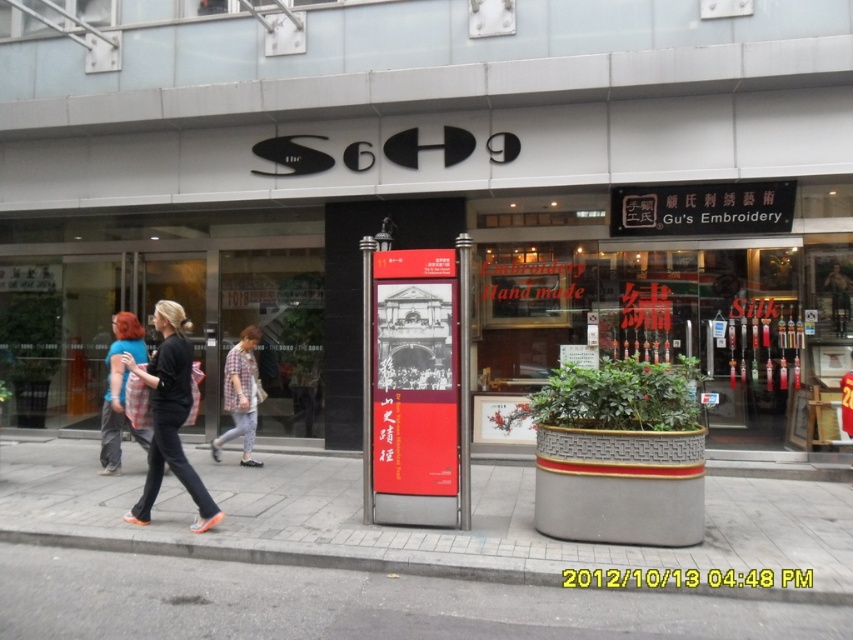
Question: Is plaid fabric shirt at left further to the viewer compared to plaid fabric shirt at center?

Choices:
 (A) no
 (B) yes

Answer: (A)

Question: Among these points, which one is nearest to the camera?

Choices:
 (A) (474, 636)
 (B) (230, 365)

Answer: (A)

Question: Can you confirm if gray concrete pavement at center is positioned above black matte pants at center?

Choices:
 (A) yes
 (B) no

Answer: (B)

Question: Which point is farther from the camera taking this photo?

Choices:
 (A) (134, 324)
 (B) (183, 380)
 (C) (257, 396)

Answer: (C)

Question: Does gray concrete pavement at center appear on the right side of plaid fabric shirt at center?

Choices:
 (A) no
 (B) yes

Answer: (B)

Question: Among these points, which one is nearest to the camera?

Choices:
 (A) (247, 342)
 (B) (107, 422)
 (C) (161, 477)
 (D) (817, 608)

Answer: (D)